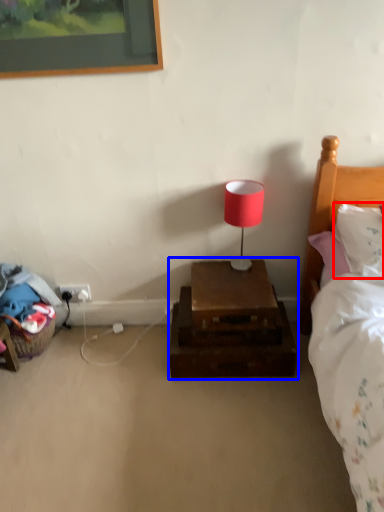
Question: Which object is closer to the camera taking this photo, pillow (highlighted by a red box) or nightstand (highlighted by a blue box)?

Choices:
 (A) pillow
 (B) nightstand

Answer: (A)